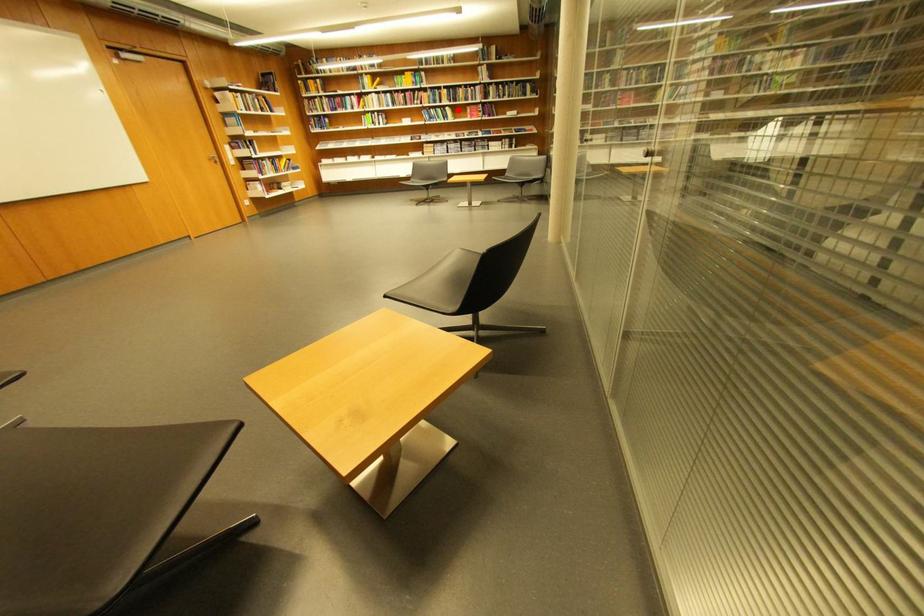
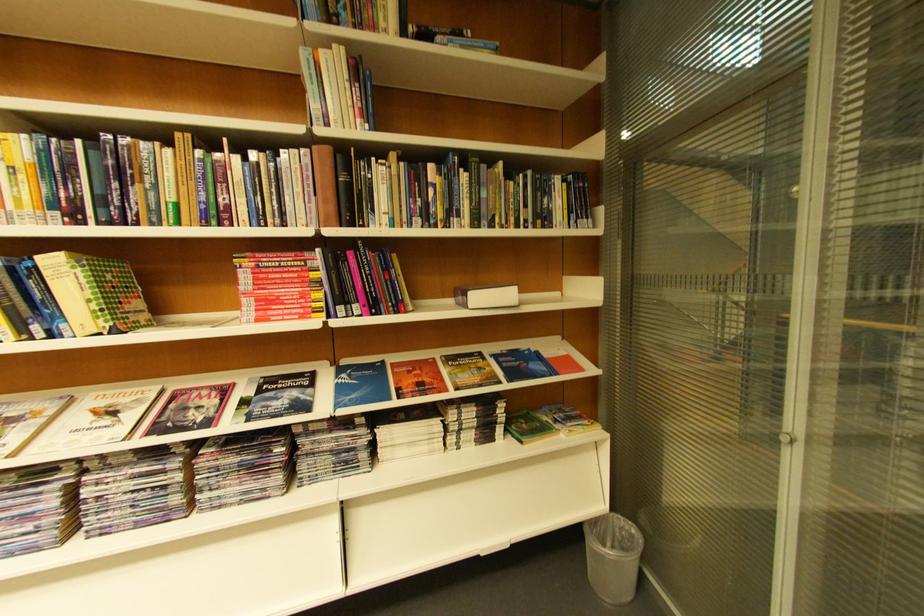
Question: I am providing you with two images of the same scene from different viewpoints. A red point is shown in image1. For the corresponding object point in image2, is it positioned nearer or farther from the camera?

Choices:
 (A) Nearer
 (B) Farther

Answer: (B)